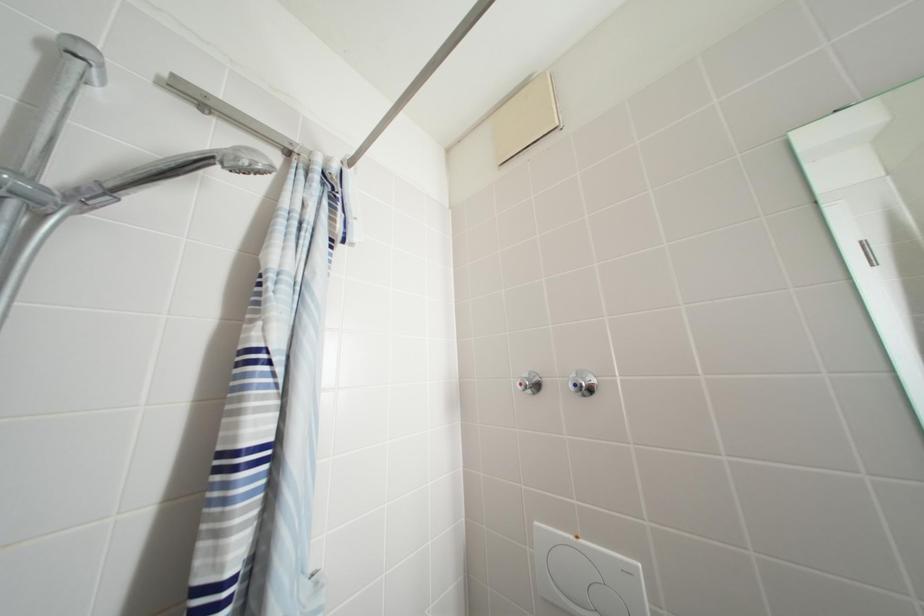
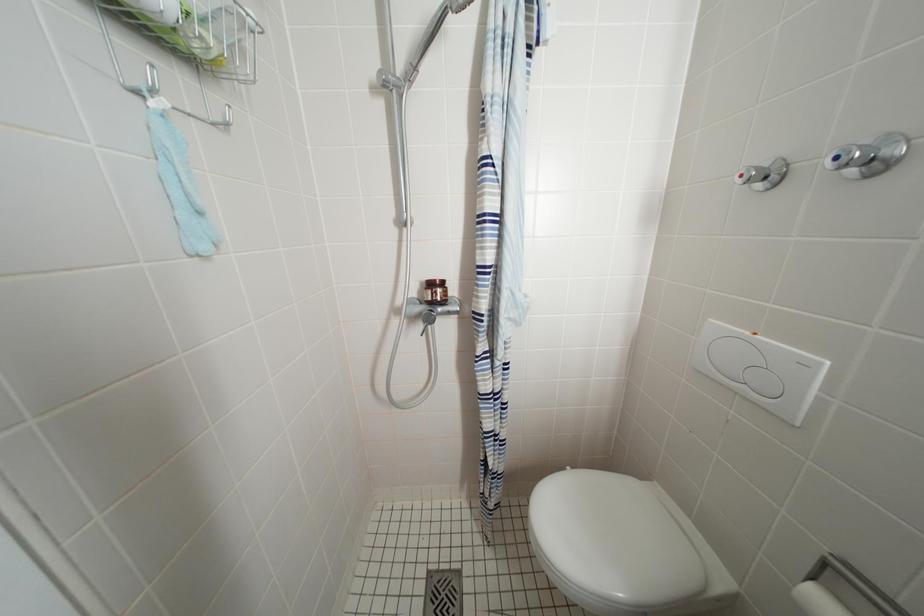
Based on the continuous images, in which direction is the camera rotating?

The rotation direction of the camera is left-down.